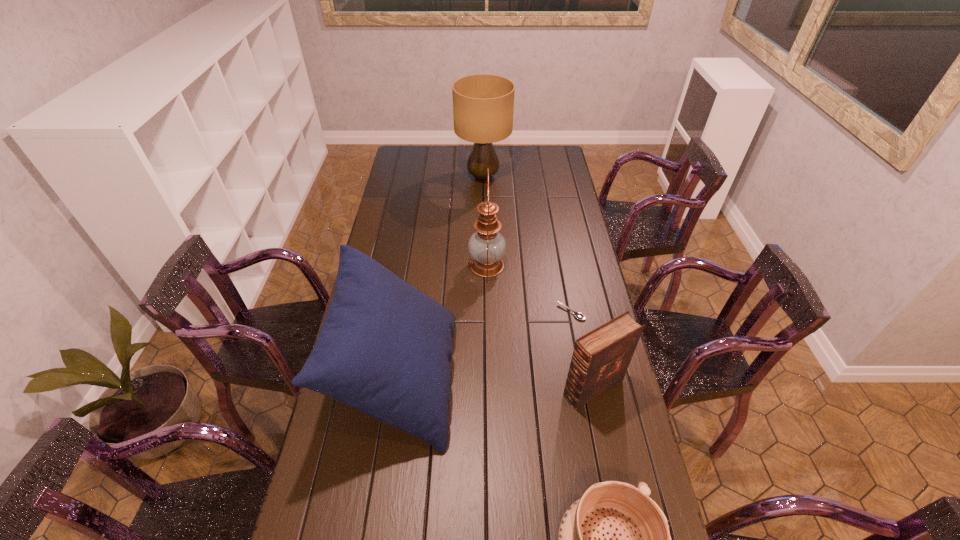
The image size is (960, 540). In order to click on object at the far edge in this screenshot , I will do `click(483, 104)`.

This screenshot has width=960, height=540. What are the coordinates of `object that is at the left edge` in the screenshot? It's located at (384, 348).

Locate an element on the screen. Image resolution: width=960 pixels, height=540 pixels. Bible that is at the right edge is located at coordinates (600, 359).

Find the location of a particular element. Image resolution: width=960 pixels, height=540 pixels. soupspoon present at the right edge is located at coordinates 578,315.

Identify the location of vacant region at the far edge of the desktop. (447, 151).

Identify the location of free space at the left edge of the desktop. Image resolution: width=960 pixels, height=540 pixels. (412, 173).

The width and height of the screenshot is (960, 540). Identify the location of free space at the right edge of the desktop. (560, 228).

In the image, there is a desktop. Where is `vacant space at the far left corner`? The image size is (960, 540). vacant space at the far left corner is located at coordinates (408, 167).

Find the location of a particular element. vacant space at the far right corner of the desktop is located at coordinates point(554,157).

I want to click on unoccupied position between the fourth tallest object and the cushion, so click(496, 383).